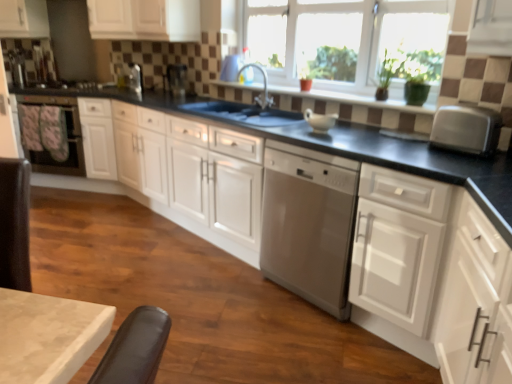
What are the coordinates of `free space above white matte cabinet at right, placed as the 1th cabinetry when sorted from right to left (from a real-world perspective)` in the screenshot? It's located at (438, 156).